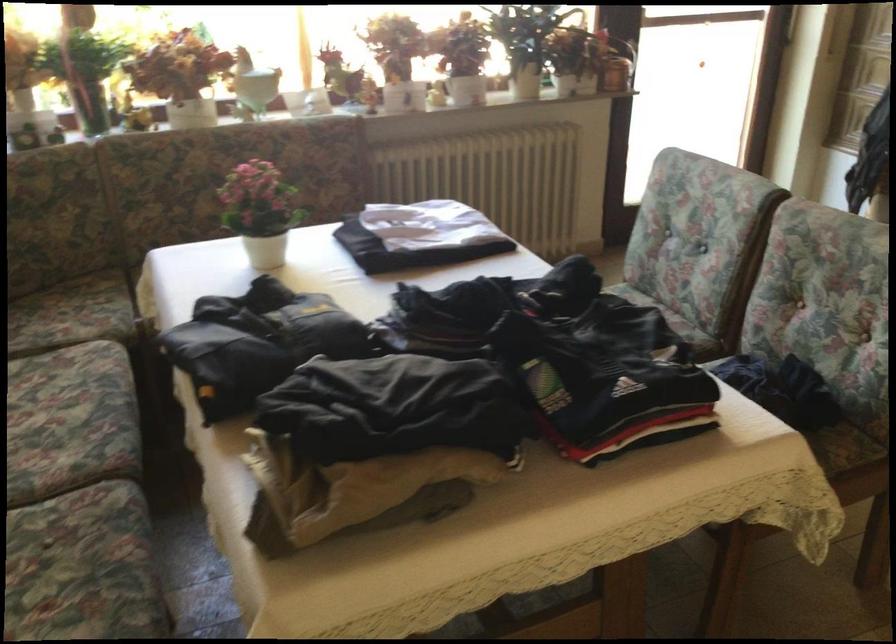
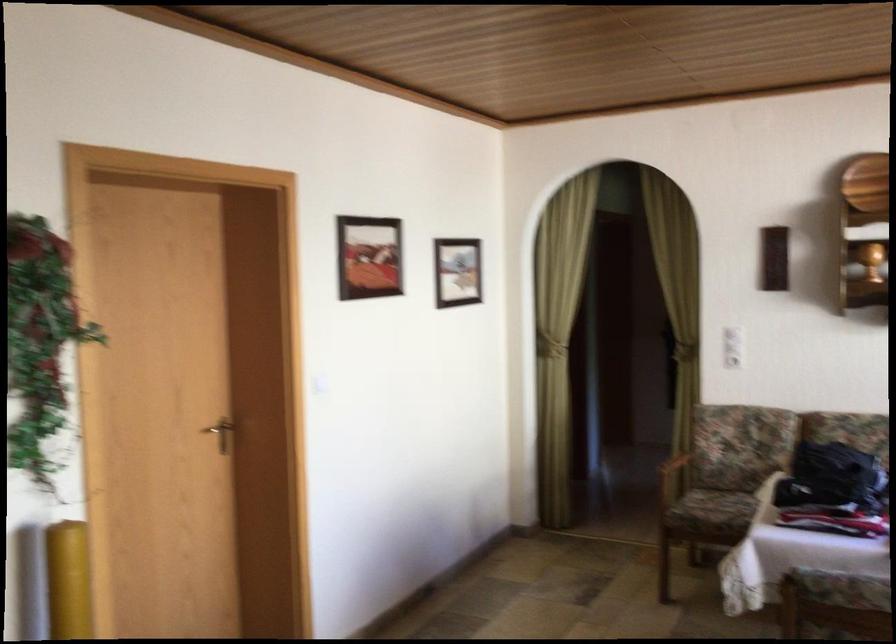
In the second image, find the point that corresponds to pixel 589 351 in the first image.

(831, 478)